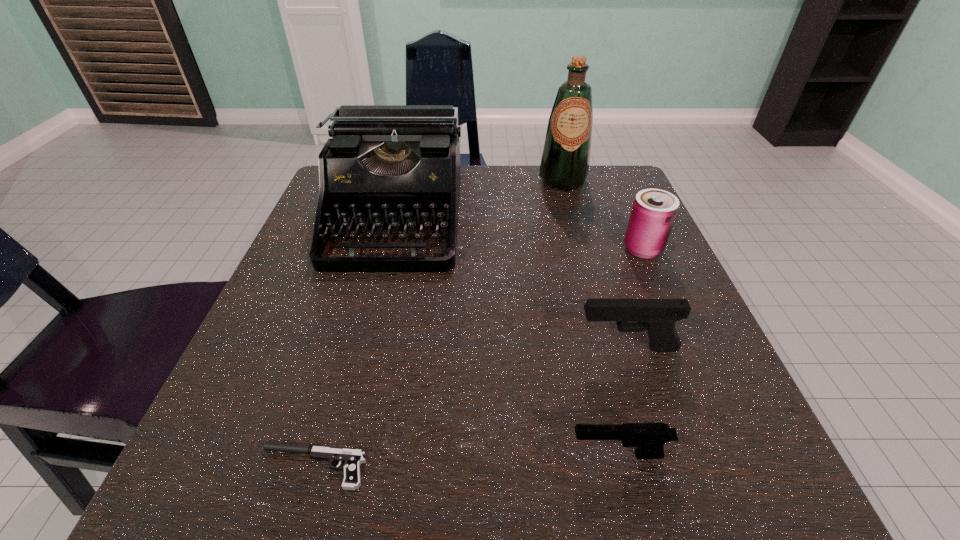
Locate an element on the screen. This screenshot has height=540, width=960. typewriter at the left edge is located at coordinates (389, 167).

At what (x,y) coordinates should I click in order to perform the action: click on pistol that is at the left edge. Please return your answer as a coordinate pair (x, y). Looking at the image, I should click on (352, 458).

At what (x,y) coordinates should I click in order to perform the action: click on olive oil that is at the right edge. Please return your answer as a coordinate pair (x, y). Looking at the image, I should click on 564,166.

Identify the location of can situated at the right edge. This screenshot has width=960, height=540. (654, 211).

In order to click on object that is at the far left corner in this screenshot , I will do `click(389, 167)`.

The width and height of the screenshot is (960, 540). Identify the location of object at the near left corner. (352, 458).

You are a GUI agent. You are given a task and a screenshot of the screen. Output one action in this format:
    pyautogui.click(x=<x>, y=<y>)
    Task: Click on the object positioned at the far right corner
    
    Given the screenshot: What is the action you would take?
    pyautogui.click(x=564, y=166)

Where is `object that is at the near right corner`? object that is at the near right corner is located at coordinates (649, 438).

Where is `vacant position at the far edge of the desktop`? This screenshot has height=540, width=960. vacant position at the far edge of the desktop is located at coordinates (492, 177).

I want to click on free space at the near edge of the desktop, so click(x=506, y=484).